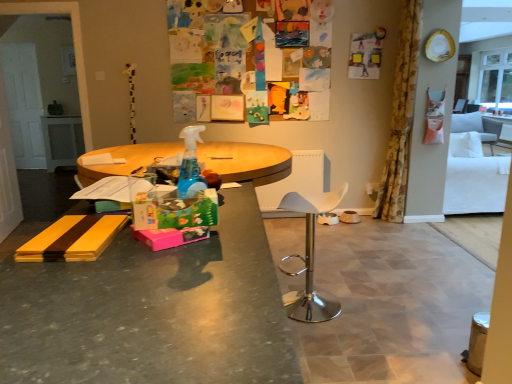
The width and height of the screenshot is (512, 384). I want to click on vacant area that is situated to the right of white plastic chair at center, so click(366, 306).